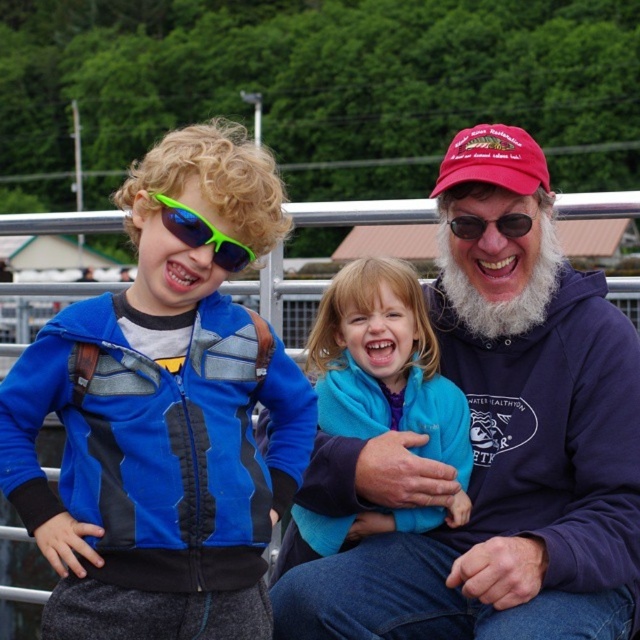
Does blue fleece jacket at center have a greater width compared to whitewoollybeard at right?

Yes, blue fleece jacket at center is wider than whitewoollybeard at right.

Can you confirm if blue fleece jacket at center is positioned to the right of whitewoollybeard at right?

Incorrect, blue fleece jacket at center is not on the right side of whitewoollybeard at right.

Identify the location of blue fleece jacket at center. Image resolution: width=640 pixels, height=640 pixels. [380, 396].

Which is behind, point (579, 358) or point (499, 220)?

Positioned behind is point (499, 220).

Who is positioned more to the left, matte blue hoodie at center or green matte sunglasses at upper center?

Positioned to the left is matte blue hoodie at center.

Where is `matte blue hoodie at center`? Image resolution: width=640 pixels, height=640 pixels. matte blue hoodie at center is located at coordinates (506, 442).

Who is taller, matte blue jacket at left or neon green plastic goggles at left?

With more height is matte blue jacket at left.

Measure the distance from matte blue jacket at left to neon green plastic goggles at left.

matte blue jacket at left and neon green plastic goggles at left are 5.68 inches apart.

Is point (195, 429) positioned after point (250, 257)?

Yes, it is.

Locate an element on the screen. This screenshot has width=640, height=640. matte blue jacket at left is located at coordinates (164, 412).